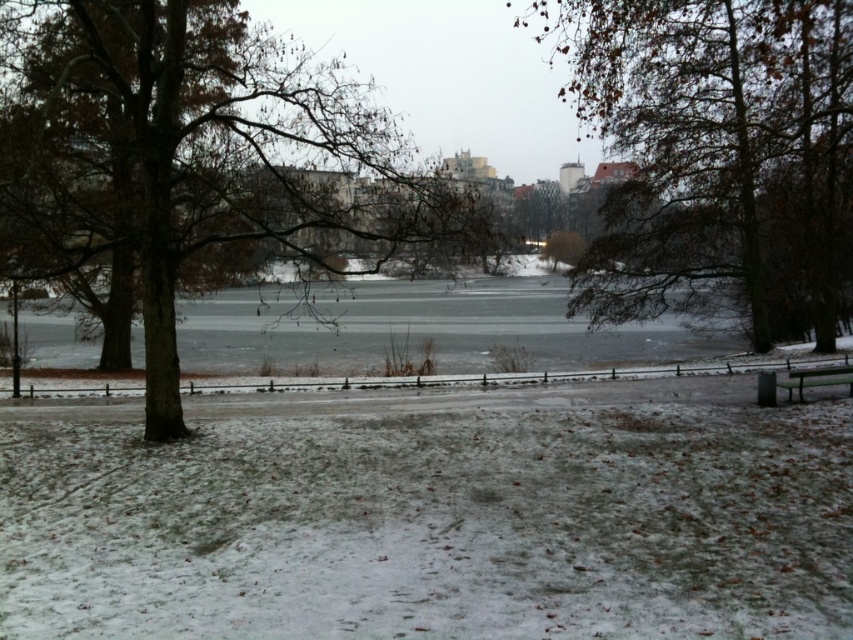
Question: Does brown leafy tree at center appear under wooden bench at lower right?

Choices:
 (A) yes
 (B) no

Answer: (B)

Question: Does brown leafy tree at center have a larger size compared to wooden bench at lower right?

Choices:
 (A) no
 (B) yes

Answer: (B)

Question: Which object is the farthest from the wooden bench at lower right?

Choices:
 (A) brown leafy tree at center
 (B) brown/drytree at left

Answer: (B)

Question: Which is farther from the wooden bench at lower right?

Choices:
 (A) brown/drytree at left
 (B) brown leafy tree at center

Answer: (A)

Question: Observing the image, what is the correct spatial positioning of brown/drytree at left in reference to wooden bench at lower right?

Choices:
 (A) left
 (B) right

Answer: (A)

Question: Which object is positioned closest to the brown/drytree at left?

Choices:
 (A) brown leafy tree at center
 (B) wooden bench at lower right

Answer: (A)